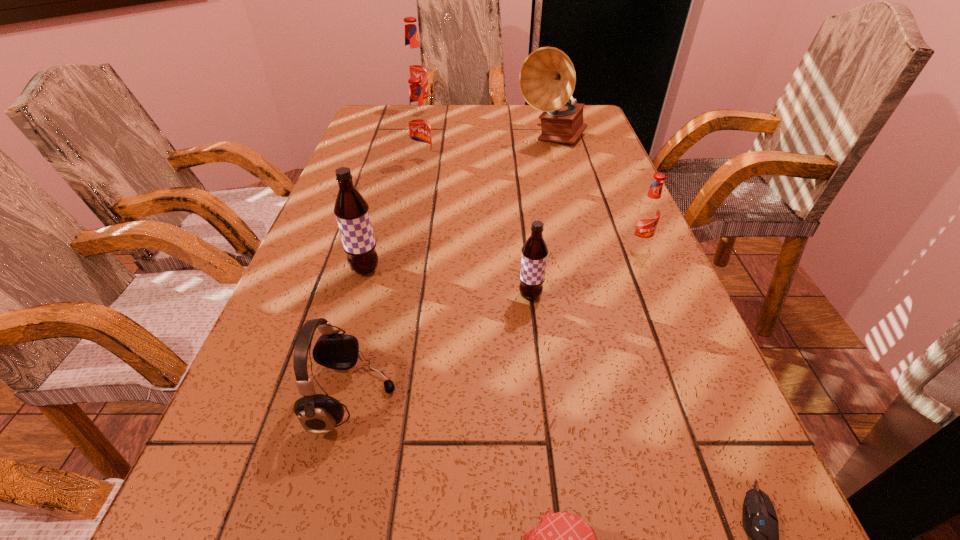
Identify which red root beer is the third closest to the eighth tallest object. Please provide its 2D coordinates. Your answer should be formatted as a tuple, i.e. [(x, y)], where the tuple contains the x and y coordinates of a point satisfying the conditions above.

[(414, 65)]

Select which red root beer is the second closest to the second nearest red root beer. Please provide its 2D coordinates. Your answer should be formatted as a tuple, i.e. [(x, y)], where the tuple contains the x and y coordinates of a point satisfying the conditions above.

[(648, 213)]

Image resolution: width=960 pixels, height=540 pixels. Identify the location of vacant area in the image that satisfies the following two spatial constraints: 1. on the front side of the farthest root beer; 2. on the right side of the third nearest root beer. (386, 244).

The width and height of the screenshot is (960, 540). I want to click on free point that satisfies the following two spatial constraints: 1. on the front side of the tallest root beer; 2. on the left side of the second nearest red root beer, so click(406, 163).

This screenshot has width=960, height=540. I want to click on vacant space that satisfies the following two spatial constraints: 1. on the horn of the rightmost red root beer; 2. on the left side of the phonograph record, so click(x=579, y=244).